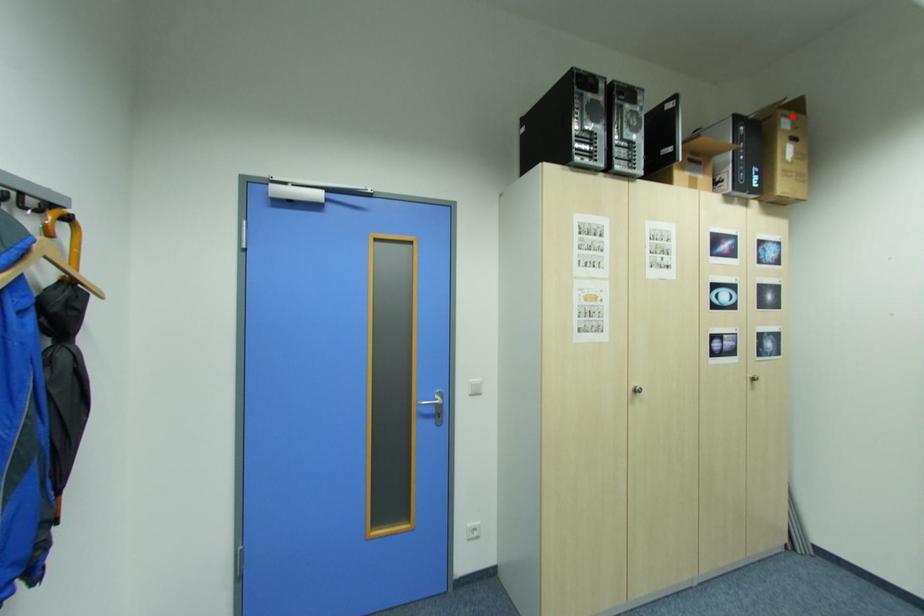
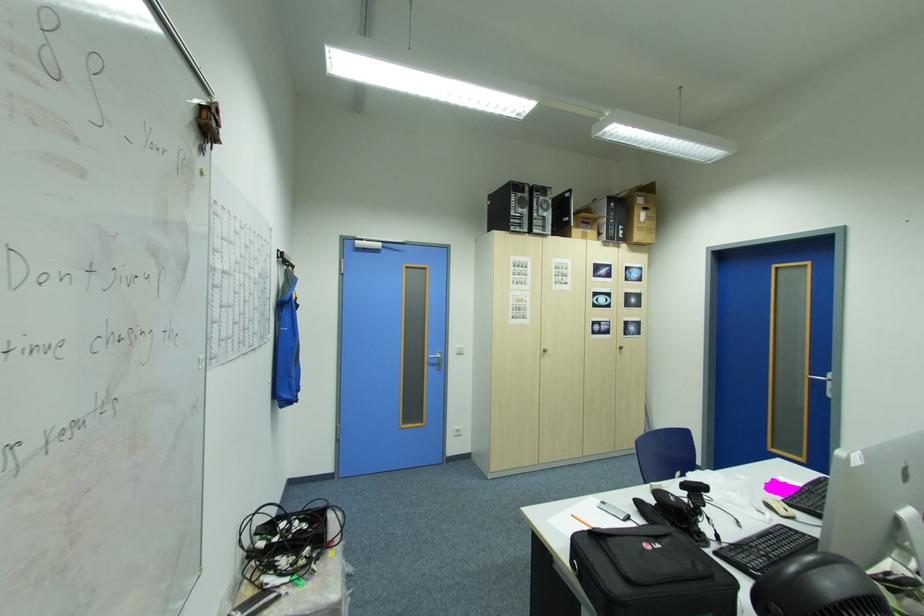
Find the pixel in the second image that matches the highlighted location in the first image.

(648, 198)